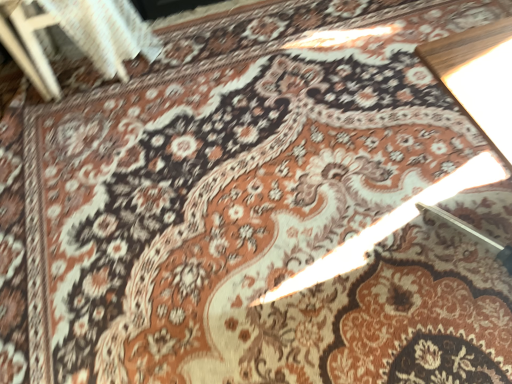
Based on the photo, in order to face white woven chair at upper left, should I rotate leftwards or rightwards?

Turn left approximately 21.055 degrees to face it.

Locate an element on the screen. The height and width of the screenshot is (384, 512). white woven chair at upper left is located at coordinates (77, 37).

Image resolution: width=512 pixels, height=384 pixels. What do you see at coordinates (77, 37) in the screenshot?
I see `white woven chair at upper left` at bounding box center [77, 37].

Locate an element on the screen. The width and height of the screenshot is (512, 384). white woven chair at upper left is located at coordinates (77, 37).